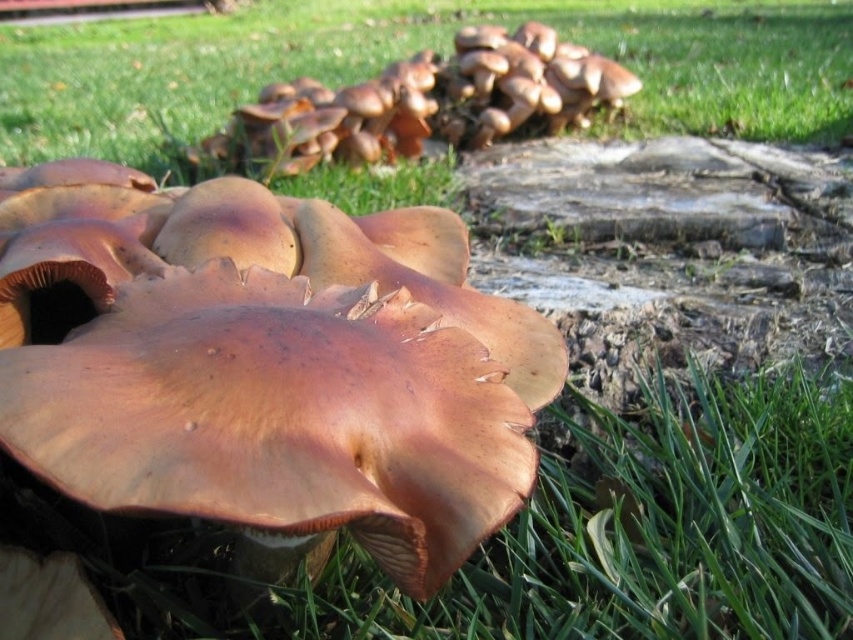
From the picture: You are standing at a point 4.70 meters away from the camera, which is the location of point (659,60). You want to take a photo of the mushrooms growing in the grassy area. Will you be able to clearly see the mushrooms in your photo if you focus on that point?

Yes, because the point (659,60) is exactly where you are standing, and since the mushrooms are in the grassy area which is part of the scene, focusing on that point should allow you to see the mushrooms clearly in your photo.

You are a gardener who wants to inspect the brown matte fungi at center. If your hand can reach up to 20 inches, can you touch it without moving closer?

The brown matte fungi at center is 21.93 inches away from the viewer, which is beyond the 20 inches reach of your hand. Therefore, you cannot touch it without moving closer.